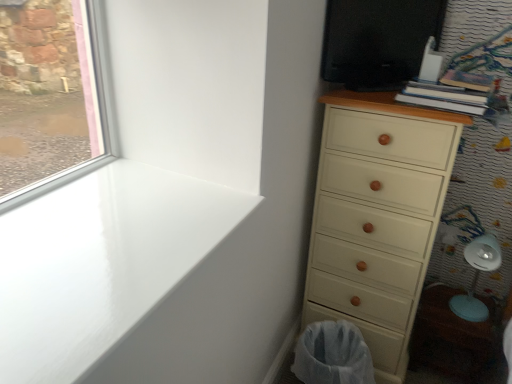
Where is `black glossy screen door at upper right`? This screenshot has width=512, height=384. black glossy screen door at upper right is located at coordinates (378, 41).

The height and width of the screenshot is (384, 512). I want to click on white glossy window sill at upper left, so click(101, 262).

Describe the element at coordinates (101, 262) in the screenshot. The height and width of the screenshot is (384, 512). I see `white glossy window sill at upper left` at that location.

Looking at this image, measure the distance between point (x=332, y=341) and camera.

5.08 feet.

Identify the location of cream matte chest of drawers at right. click(x=377, y=217).

Who is more distant, white glossy window sill at upper left or white mesh laundry basket at lower right?

white mesh laundry basket at lower right is further from the camera.

Locate an element on the screen. This screenshot has width=512, height=384. laundry basket on the right side of white glossy window sill at upper left is located at coordinates (332, 355).

Is white mesh laundry basket at lower right completely or partially inside white glossy window sill at upper left?

Definitely not — white mesh laundry basket at lower right is not inside white glossy window sill at upper left.

Is point (211, 204) positioned behind point (352, 329)?

No, (211, 204) is in front of (352, 329).

Based on their sizes in the image, would you say cream matte chest of drawers at right is bigger or smaller than black glossy screen door at upper right?

In the image, cream matte chest of drawers at right appears to be larger than black glossy screen door at upper right.

Is the position of cream matte chest of drawers at right less distant than that of black glossy screen door at upper right?

Yes.

Which is nearer, (362, 298) or (337, 19)?

Clearly, point (362, 298) is more distant from the camera than point (337, 19).

From the image's perspective, is cream matte chest of drawers at right located above black glossy screen door at upper right?

Incorrect, from the image's perspective, cream matte chest of drawers at right is lower than black glossy screen door at upper right.

Is cream matte chest of drawers at right a part of white plastic swivel chair at lower right?

No, cream matte chest of drawers at right is not surrounded by white plastic swivel chair at lower right.

Which object is positioned more to the right, white plastic swivel chair at lower right or cream matte chest of drawers at right?

white plastic swivel chair at lower right.

From a real-world perspective, is white plastic swivel chair at lower right physically located above or below cream matte chest of drawers at right?

In terms of real-world spatial position, white plastic swivel chair at lower right is below cream matte chest of drawers at right.

Between white glossy window sill at upper left and cream matte chest of drawers at right, which one appears on the left side from the viewer's perspective?

white glossy window sill at upper left.

Looking at this image, does white glossy window sill at upper left have a larger size compared to cream matte chest of drawers at right?

No.

Based on the photo, is white glossy window sill at upper left in front of cream matte chest of drawers at right?

Yes.

Looking at this image, can we say white mesh laundry basket at lower right lies outside white plastic swivel chair at lower right?

white mesh laundry basket at lower right lies outside white plastic swivel chair at lower right's area.

From a real-world perspective, who is located lower, white mesh laundry basket at lower right or white plastic swivel chair at lower right?

From a 3D spatial view, white mesh laundry basket at lower right is below.

Which point is more forward, (342,333) or (454,298)?

The point (342,333) is more forward.

Does white plastic swivel chair at lower right have a smaller size compared to white mesh laundry basket at lower right?

Yes.

In the scene shown: Is white plastic swivel chair at lower right turned away from white mesh laundry basket at lower right?

white plastic swivel chair at lower right is not turned away from white mesh laundry basket at lower right.

Which is in front, point (452, 309) or point (367, 359)?

The point (367, 359) is more forward.

Which object is closer to the camera, white plastic swivel chair at lower right or white mesh laundry basket at lower right?

white mesh laundry basket at lower right is closer to the camera.

From the image's perspective, which one is positioned higher, black glossy screen door at upper right or cream matte chest of drawers at right?

From the image's view, black glossy screen door at upper right is above.

Can you confirm if black glossy screen door at upper right is positioned to the left of cream matte chest of drawers at right?

Indeed, black glossy screen door at upper right is positioned on the left side of cream matte chest of drawers at right.

From a real-world perspective, is black glossy screen door at upper right positioned under cream matte chest of drawers at right based on gravity?

No, from a real-world perspective, black glossy screen door at upper right is not below cream matte chest of drawers at right.

Are black glossy screen door at upper right and cream matte chest of drawers at right making contact?

There is a gap between black glossy screen door at upper right and cream matte chest of drawers at right.

Where is `laundry basket lying on the right of white glossy window sill at upper left`? laundry basket lying on the right of white glossy window sill at upper left is located at coordinates (332, 355).

The image size is (512, 384). I want to click on screen door located above the cream matte chest of drawers at right (from a real-world perspective), so click(378, 41).

When comparing their distances from cream matte chest of drawers at right, does black glossy screen door at upper right or white mesh laundry basket at lower right seem further?

Among the two, black glossy screen door at upper right is located further to cream matte chest of drawers at right.

Considering their positions, is white glossy window sill at upper left positioned further to cream matte chest of drawers at right than white mesh laundry basket at lower right?

white glossy window sill at upper left.

From the image, which object appears to be nearer to black glossy screen door at upper right, white plastic swivel chair at lower right or white mesh laundry basket at lower right?

white plastic swivel chair at lower right.

Looking at the image, which one is located further to white plastic swivel chair at lower right, white glossy window sill at upper left or white mesh laundry basket at lower right?

white glossy window sill at upper left lies further to white plastic swivel chair at lower right than the other object.

Considering their positions, is cream matte chest of drawers at right positioned further to white mesh laundry basket at lower right than white glossy window sill at upper left?

white glossy window sill at upper left lies further to white mesh laundry basket at lower right than the other object.

From the image, which object appears to be farther from cream matte chest of drawers at right, black glossy screen door at upper right or white glossy window sill at upper left?

white glossy window sill at upper left is positioned further to the anchor cream matte chest of drawers at right.

When comparing their distances from white plastic swivel chair at lower right, does white glossy window sill at upper left or cream matte chest of drawers at right seem closer?

Among the two, cream matte chest of drawers at right is located nearer to white plastic swivel chair at lower right.

From the image, which object appears to be farther from white glossy window sill at upper left, cream matte chest of drawers at right or black glossy screen door at upper right?

black glossy screen door at upper right is further to white glossy window sill at upper left.

Find the location of a particular element. This screenshot has width=512, height=384. chest of drawers between white glossy window sill at upper left and white plastic swivel chair at lower right is located at coordinates (377, 217).

Where is `screen door situated between white glossy window sill at upper left and white plastic swivel chair at lower right from left to right`? The height and width of the screenshot is (384, 512). screen door situated between white glossy window sill at upper left and white plastic swivel chair at lower right from left to right is located at coordinates (378, 41).

At what (x,y) coordinates should I click in order to perform the action: click on window sill that lies between black glossy screen door at upper right and white mesh laundry basket at lower right from top to bottom. Please return your answer as a coordinate pair (x, y). Looking at the image, I should click on (101, 262).

Locate an element on the screen. The image size is (512, 384). swivel chair between black glossy screen door at upper right and white mesh laundry basket at lower right from top to bottom is located at coordinates (477, 277).